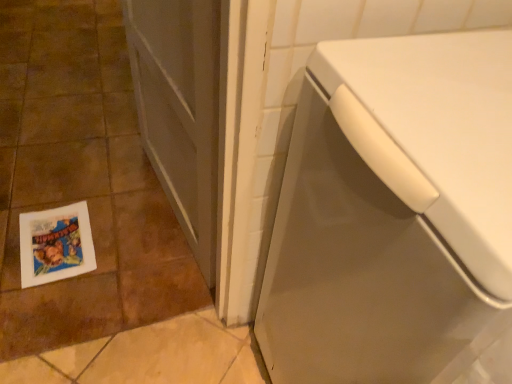
This screenshot has height=384, width=512. What do you see at coordinates (82, 180) in the screenshot?
I see `white glossy tile at lower left` at bounding box center [82, 180].

Based on the photo, in order to face matte gray screen door at center, should I rotate leftwards or rightwards?

It's best to rotate left around 11.894 degrees.

This screenshot has height=384, width=512. What do you see at coordinates (180, 109) in the screenshot? I see `matte gray screen door at center` at bounding box center [180, 109].

Find the location of a particular element. white paper flyer at lower left is located at coordinates (55, 244).

I want to click on white glossy tile at lower left, so coord(82,180).

Are matte gray screen door at center and white paper flyer at lower left far apart?

That's not correct — matte gray screen door at center is a little close to white paper flyer at lower left.

Is matte gray screen door at center completely or partially outside of white paper flyer at lower left?

matte gray screen door at center lies outside white paper flyer at lower left's area.

From a real-world perspective, relative to white paper flyer at lower left, is matte gray screen door at center vertically above or below?

Clearly, from a real-world perspective, matte gray screen door at center is above white paper flyer at lower left.

Does matte gray screen door at center have a larger size compared to white paper flyer at lower left?

Correct, matte gray screen door at center is larger in size than white paper flyer at lower left.

From the picture: Considering the relative sizes of white glossy washing machine at lower right and matte gray screen door at center in the image provided, is white glossy washing machine at lower right bigger than matte gray screen door at center?

Yes, white glossy washing machine at lower right is bigger than matte gray screen door at center.

Does white glossy washing machine at lower right turn towards matte gray screen door at center?

No.

Considering the relative sizes of white glossy washing machine at lower right and matte gray screen door at center in the image provided, is white glossy washing machine at lower right shorter than matte gray screen door at center?

In fact, white glossy washing machine at lower right may be taller than matte gray screen door at center.

From a real-world perspective, does white glossy washing machine at lower right stand above white glossy tile at lower left?

Yes, from a real-world perspective, white glossy washing machine at lower right is above white glossy tile at lower left.

Is white glossy washing machine at lower right thinner than white glossy tile at lower left?

Incorrect, the width of white glossy washing machine at lower right is not less than that of white glossy tile at lower left.

Which of these two, white glossy washing machine at lower right or white glossy tile at lower left, is smaller?

white glossy tile at lower left.

Can you confirm if white paper flyer at lower left is shorter than white glossy tile at lower left?

Yes.

From the image's perspective, which is above, white paper flyer at lower left or white glossy tile at lower left?

white glossy tile at lower left is shown above in the image.

Considering the relative positions of white paper flyer at lower left and white glossy tile at lower left in the image provided, is white paper flyer at lower left to the left of white glossy tile at lower left from the viewer's perspective?

No, white paper flyer at lower left is not to the left of white glossy tile at lower left.

Considering the sizes of objects white paper flyer at lower left and white glossy tile at lower left in the image provided, who is smaller, white paper flyer at lower left or white glossy tile at lower left?

With smaller size is white paper flyer at lower left.

Is white glossy tile at lower left not within white glossy washing machine at lower right?

white glossy tile at lower left lies outside white glossy washing machine at lower right's area.

Considering the positions of objects white glossy tile at lower left and white glossy washing machine at lower right in the image provided, who is more to the left, white glossy tile at lower left or white glossy washing machine at lower right?

white glossy tile at lower left is more to the left.

Is white glossy tile at lower left smaller than white glossy washing machine at lower right?

Yes, white glossy tile at lower left is smaller than white glossy washing machine at lower right.

Who is shorter, white glossy tile at lower left or white glossy washing machine at lower right?

With less height is white glossy tile at lower left.

Could you tell me if white paper flyer at lower left is facing white glossy washing machine at lower right?

No, white paper flyer at lower left does not turn towards white glossy washing machine at lower right.

Is white paper flyer at lower left wider than white glossy washing machine at lower right?

No.

In terms of size, does white paper flyer at lower left appear bigger or smaller than white glossy washing machine at lower right?

Clearly, white paper flyer at lower left is smaller in size than white glossy washing machine at lower right.

From the image's perspective, does matte gray screen door at center appear higher than white glossy tile at lower left?

Actually, matte gray screen door at center appears below white glossy tile at lower left in the image.

From a real-world perspective, which object stands above the other?

In real-world perspective, matte gray screen door at center is above.

Is matte gray screen door at center wider or thinner than white glossy tile at lower left?

In the image, matte gray screen door at center appears to be more narrow than white glossy tile at lower left.

Which is more to the right, matte gray screen door at center or white glossy tile at lower left?

matte gray screen door at center is more to the right.

Where is `flyer on the left of matte gray screen door at center`? The image size is (512, 384). flyer on the left of matte gray screen door at center is located at coordinates (55, 244).

The width and height of the screenshot is (512, 384). I want to click on screen door located behind the white glossy washing machine at lower right, so click(180, 109).

Considering their positions, is white glossy washing machine at lower right positioned closer to white paper flyer at lower left than matte gray screen door at center?

Based on the image, matte gray screen door at center appears to be nearer to white paper flyer at lower left.

From the image, which object appears to be nearer to white glossy tile at lower left, white glossy washing machine at lower right or white paper flyer at lower left?

The object closer to white glossy tile at lower left is white paper flyer at lower left.

From the image, which object appears to be farther from white glossy washing machine at lower right, matte gray screen door at center or white paper flyer at lower left?

The object further to white glossy washing machine at lower right is white paper flyer at lower left.

Looking at the image, which one is located further to matte gray screen door at center, white glossy washing machine at lower right or white paper flyer at lower left?

white glossy washing machine at lower right.

Based on their spatial positions, is white paper flyer at lower left or matte gray screen door at center closer to white glossy tile at lower left?

The object closer to white glossy tile at lower left is white paper flyer at lower left.

Based on their spatial positions, is matte gray screen door at center or white glossy tile at lower left closer to white paper flyer at lower left?

The object closer to white paper flyer at lower left is white glossy tile at lower left.

When comparing their distances from matte gray screen door at center, does white glossy tile at lower left or white paper flyer at lower left seem further?

white paper flyer at lower left is further to matte gray screen door at center.

Considering their positions, is white glossy washing machine at lower right positioned closer to matte gray screen door at center than white glossy tile at lower left?

Based on the image, white glossy tile at lower left appears to be nearer to matte gray screen door at center.

Locate an element on the screen. The image size is (512, 384). flyer between white glossy tile at lower left and white glossy washing machine at lower right in the horizontal direction is located at coordinates (55, 244).

I want to click on screen door between white glossy tile at lower left and white paper flyer at lower left vertically, so 180,109.

Identify the location of screen door between white paper flyer at lower left and white glossy washing machine at lower right in the horizontal direction. Image resolution: width=512 pixels, height=384 pixels. (180, 109).

I want to click on screen door between white glossy tile at lower left and white glossy washing machine at lower right from left to right, so click(180, 109).